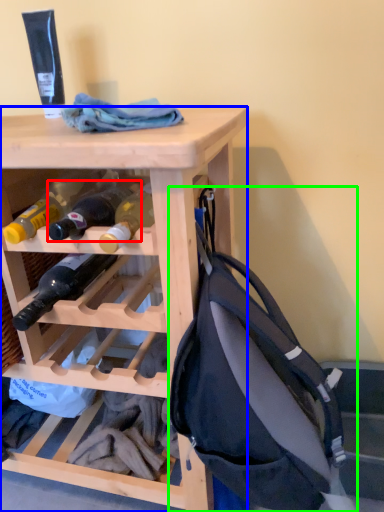
Question: Which object is positioned farthest from bottle (highlighted by a red box)? Select from desk (highlighted by a blue box) and backpack (highlighted by a green box).

Choices:
 (A) desk
 (B) backpack

Answer: (B)